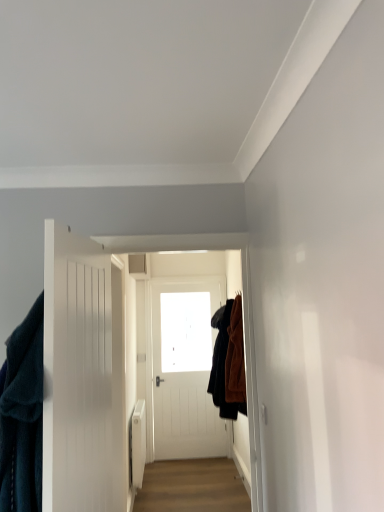
Question: Is velvety dark blue robe at left, the first clothing positioned from the left, directly adjacent to transparent glass window at center?

Choices:
 (A) yes
 (B) no

Answer: (B)

Question: From the image's perspective, is velvety dark blue robe at left, the 2th clothing when ordered from back to front, under transparent glass window at center?

Choices:
 (A) no
 (B) yes

Answer: (A)

Question: From a real-world perspective, does velvety dark blue robe at left, the first clothing positioned from the left, sit lower than transparent glass window at center?

Choices:
 (A) no
 (B) yes

Answer: (B)

Question: Is transparent glass window at center a part of velvety dark blue robe at left, placed as the 2th clothing when sorted from right to left?

Choices:
 (A) yes
 (B) no

Answer: (B)

Question: Is velvety dark blue robe at left, placed as the 1th clothing when sorted from front to back, not within transparent glass window at center?

Choices:
 (A) yes
 (B) no

Answer: (A)

Question: Considering the positions of white wooden door at left and velvet brown coat at right, positioned as the first clothing in right-to-left order, in the image, is white wooden door at left bigger or smaller than velvet brown coat at right, positioned as the first clothing in right-to-left order,?

Choices:
 (A) small
 (B) big

Answer: (A)

Question: From the image's perspective, is white wooden door at left located above or below velvet brown coat at right, positioned as the first clothing in right-to-left order?

Choices:
 (A) above
 (B) below

Answer: (A)

Question: In terms of height, does white wooden door at left look taller or shorter compared to velvet brown coat at right, the 2th clothing positioned from the front?

Choices:
 (A) short
 (B) tall

Answer: (B)

Question: Based on their positions, is white wooden door at left located to the left or right of velvet brown coat at right, placed as the first clothing when sorted from back to front?

Choices:
 (A) right
 (B) left

Answer: (B)

Question: From a real-world perspective, is white wooden door at left positioned above or below transparent glass window at center?

Choices:
 (A) above
 (B) below

Answer: (B)

Question: Considering the positions of white wooden door at left and transparent glass window at center in the image, is white wooden door at left wider or thinner than transparent glass window at center?

Choices:
 (A) wide
 (B) thin

Answer: (A)

Question: In terms of height, does white wooden door at left look taller or shorter compared to transparent glass window at center?

Choices:
 (A) tall
 (B) short

Answer: (A)

Question: In the image, is white wooden door at left positioned in front of or behind transparent glass window at center?

Choices:
 (A) front
 (B) behind

Answer: (A)

Question: In the image, is transparent glass window at center positioned in front of or behind light brown wood floor at center?

Choices:
 (A) behind
 (B) front

Answer: (A)

Question: Choose the correct answer: Is transparent glass window at center inside light brown wood floor at center or outside it?

Choices:
 (A) inside
 (B) outside

Answer: (B)